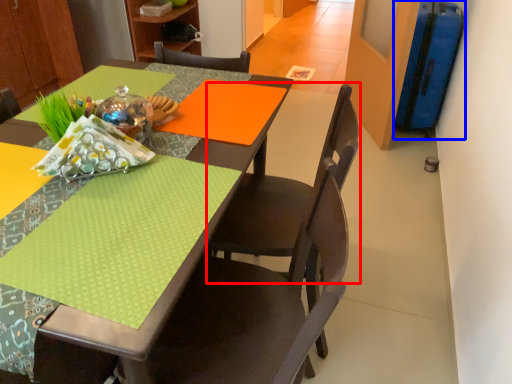
Question: Which of the following is the farthest to the observer, chair (highlighted by a red box) or luggage (highlighted by a blue box)?

Choices:
 (A) chair
 (B) luggage

Answer: (B)